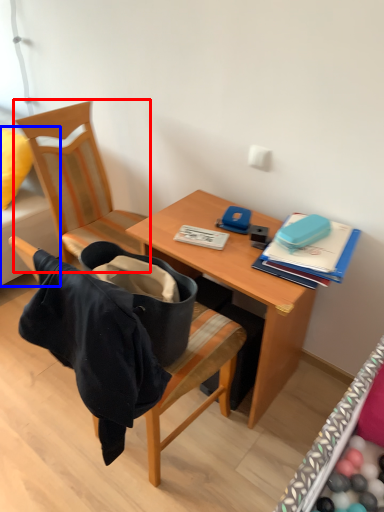
Question: Which object is further to the camera taking this photo, chair (highlighted by a red box) or studio couch (highlighted by a blue box)?

Choices:
 (A) chair
 (B) studio couch

Answer: (B)